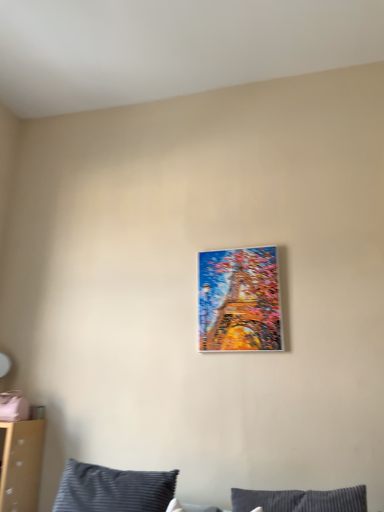
Question: Considering the positions of metallic gold painting at center and dark blue striped pillow at lower center in the image, is metallic gold painting at center bigger or smaller than dark blue striped pillow at lower center?

Choices:
 (A) big
 (B) small

Answer: (B)

Question: Is metallic gold painting at center inside the boundaries of dark blue striped pillow at lower center, or outside?

Choices:
 (A) inside
 (B) outside

Answer: (B)

Question: In terms of width, does metallic gold painting at center look wider or thinner when compared to dark blue striped pillow at lower center?

Choices:
 (A) thin
 (B) wide

Answer: (A)

Question: From the image's perspective, is dark blue striped pillow at lower center positioned above or below metallic gold painting at center?

Choices:
 (A) above
 (B) below

Answer: (B)

Question: Considering the positions of dark blue striped pillow at lower center and metallic gold painting at center in the image, is dark blue striped pillow at lower center bigger or smaller than metallic gold painting at center?

Choices:
 (A) big
 (B) small

Answer: (A)

Question: Based on their positions, is dark blue striped pillow at lower center located to the left or right of metallic gold painting at center?

Choices:
 (A) right
 (B) left

Answer: (B)

Question: Is point (72, 494) positioned closer to the camera than point (276, 320)?

Choices:
 (A) closer
 (B) farther

Answer: (A)